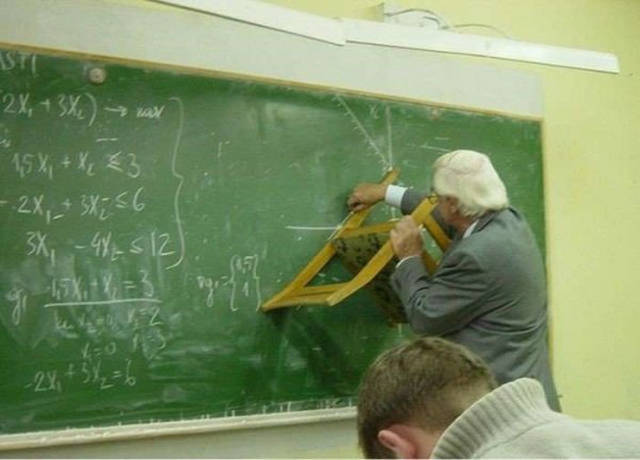
Locate an element on the screen. The height and width of the screenshot is (460, 640). chalkboard is located at coordinates (207, 213).